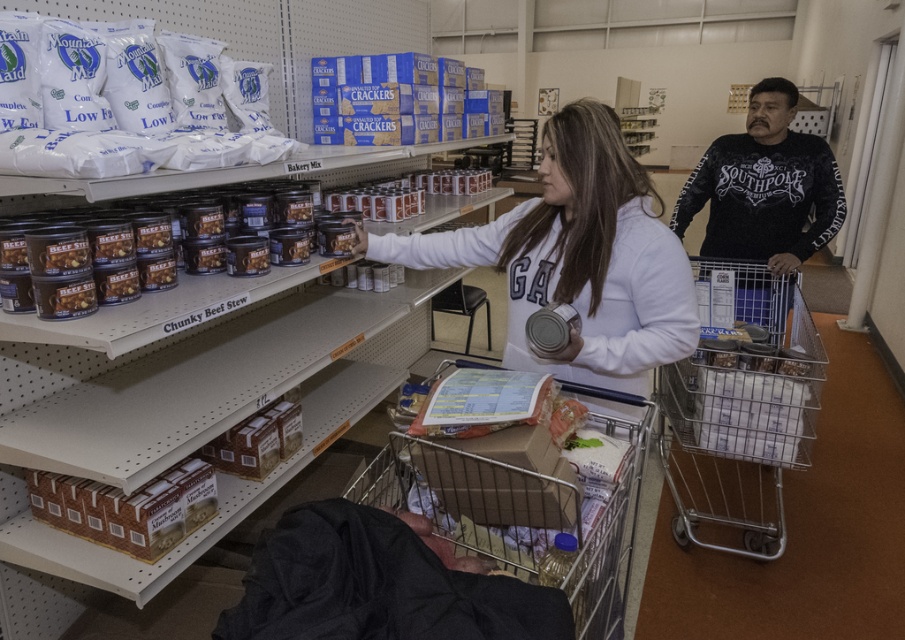
Is point (784, 362) positioned in front of point (576, 584)?

No, it is behind (576, 584).

Image resolution: width=905 pixels, height=640 pixels. In order to click on silver metal shopping cart at lower right in this screenshot , I will do `click(740, 412)`.

Is point (675, 506) farther from camera compared to point (475, 368)?

Yes, it is behind point (475, 368).

Identify the location of silver metal shopping cart at lower right. Image resolution: width=905 pixels, height=640 pixels. (740, 412).

Measure the distance from white matte sweatshirt at center to metallic silver shopping cart at lower center.

33.62 centimeters

Is white matte sweatshirt at center positioned in front of metallic silver shopping cart at lower center?

No, it is not.

Is point (575, 365) closer to camera compared to point (351, 499)?

Yes, point (575, 365) is in front of point (351, 499).

At what (x,y) coordinates should I click in order to perform the action: click on white matte sweatshirt at center. Please return your answer as a coordinate pair (x, y). The image size is (905, 640). Looking at the image, I should click on (577, 257).

Can you confirm if white matte sweatshirt at center is bigger than silver metal shopping cart at lower right?

No, white matte sweatshirt at center is not bigger than silver metal shopping cart at lower right.

From the picture: Who is more distant from viewer, (570, 252) or (767, 352)?

Positioned behind is point (767, 352).

Identify the location of white matte sweatshirt at center. This screenshot has height=640, width=905. tap(577, 257).